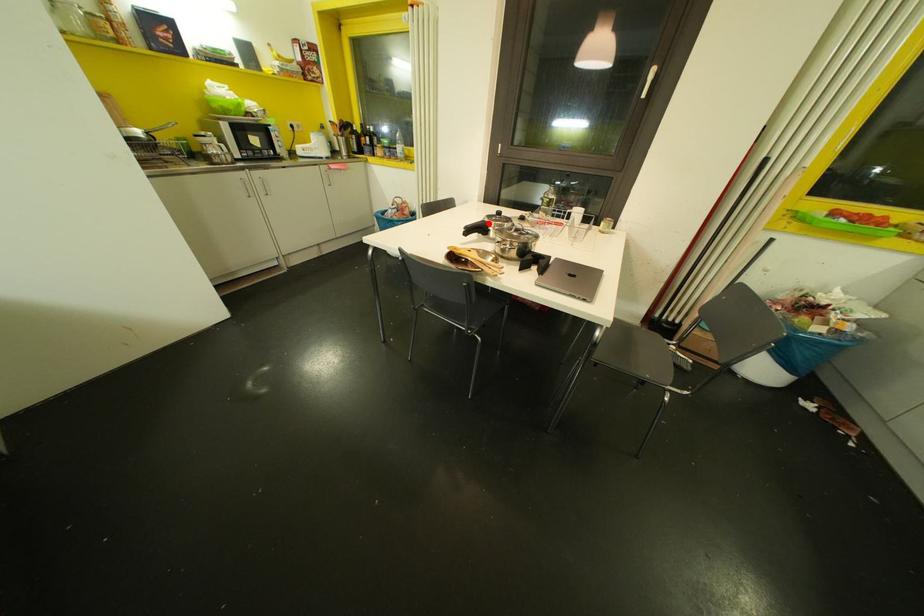
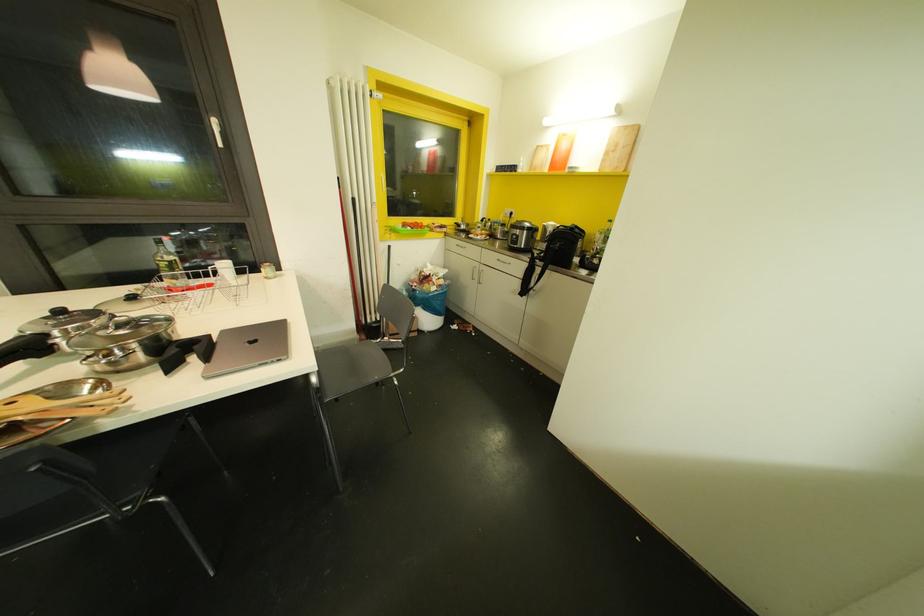
Question: I am providing you with two images of the same scene from different viewpoints. A red point is marked on the first image. At the location where the point appears in image 1, is it still visible in image 2?

Choices:
 (A) Yes
 (B) No

Answer: (A)